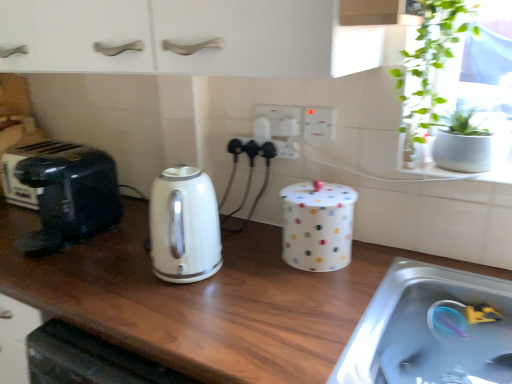
The height and width of the screenshot is (384, 512). I want to click on free location above wooden at center (from a real-world perspective), so click(154, 260).